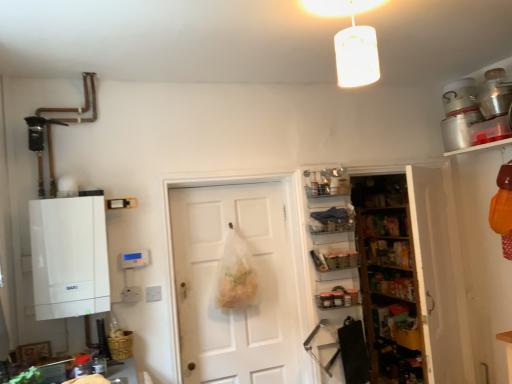
Image resolution: width=512 pixels, height=384 pixels. Describe the element at coordinates (69, 257) in the screenshot. I see `white matte boiler at left` at that location.

What is the approximate height of clear plastic shelves at center, the 4th shelf from the bottom?

It is 9.45 inches.

Measure the distance between point [507,110] and camera.

They are 2.73 meters apart.

At what (x,y) coordinates should I click in order to perform the action: click on white matte boiler at left. Please return your answer as a coordinate pair (x, y). Looking at the image, I should click on tap(69, 257).

From a real-world perspective, is metallic silver pot at upper right, the 1th appliance viewed from the front, on metallic silver spice jars at center-right, placed as the fourth shelf when sorted from top to bottom?

Correct, in the physical world, metallic silver pot at upper right, the 1th appliance viewed from the front, is higher than metallic silver spice jars at center-right, placed as the fourth shelf when sorted from top to bottom.

How many degrees apart are the facing directions of metallic silver pot at upper right, the 1th appliance viewed from the front, and metallic silver spice jars at center-right, placed as the fourth shelf when sorted from top to bottom?

91.3 degrees.

From the image's perspective, is metallic silver pot at upper right, the 1th appliance viewed from the front, located above or below metallic silver spice jars at center-right, placed as the fourth shelf when sorted from top to bottom?

metallic silver pot at upper right, the 1th appliance viewed from the front, is above metallic silver spice jars at center-right, placed as the fourth shelf when sorted from top to bottom.

From the image's perspective, does wooden shelves at right, marked as the third shelf in a top-to-bottom arrangement, appear lower than white matte cylinder at upper center?

Correct, wooden shelves at right, marked as the third shelf in a top-to-bottom arrangement, appears lower than white matte cylinder at upper center in the image.

Considering the relative sizes of wooden shelves at right, which appears as the second shelf when ordered from the bottom, and white matte cylinder at upper center in the image provided, is wooden shelves at right, which appears as the second shelf when ordered from the bottom, shorter than white matte cylinder at upper center?

Incorrect, the height of wooden shelves at right, which appears as the second shelf when ordered from the bottom, does not fall short of that of white matte cylinder at upper center.

Which point is more distant from viewer, (414,262) or (320,10)?

Point (414,262)

Considering their positions, is wooden shelves at right, marked as the third shelf in a top-to-bottom arrangement, located in front of or behind white matte cylinder at upper center?

In the image, wooden shelves at right, marked as the third shelf in a top-to-bottom arrangement, appears behind white matte cylinder at upper center.

Looking at their sizes, would you say bamboo basket at lower left is wider or thinner than clear plastic shelves at center, the first shelf when ordered from top to bottom?

Answer: In the image, bamboo basket at lower left appears to be wider than clear plastic shelves at center, the first shelf when ordered from top to bottom.

Can we say bamboo basket at lower left lies outside clear plastic shelves at center, the first shelf when ordered from top to bottom?

Yes, bamboo basket at lower left is not within clear plastic shelves at center, the first shelf when ordered from top to bottom.

Between bamboo basket at lower left and clear plastic shelves at center, the first shelf when ordered from top to bottom, which one appears on the left side from the viewer's perspective?

bamboo basket at lower left.

From the image's perspective, is metallic silver spice jars at center-right, placed as the fourth shelf when sorted from top to bottom, below white matte door at center?

Yes.

Can you confirm if metallic silver spice jars at center-right, placed as the fourth shelf when sorted from top to bottom, is smaller than white matte door at center?

Correct, metallic silver spice jars at center-right, placed as the fourth shelf when sorted from top to bottom, occupies less space than white matte door at center.

Does point (342, 299) appear closer or farther from the camera than point (225, 367)?

Point (342, 299) is positioned closer to the camera compared to point (225, 367).

Is metallic silver spice jars at center-right, placed as the fourth shelf when sorted from top to bottom, next to clear plastic shelves at center, the 4th shelf from the bottom, and touching it?

No, metallic silver spice jars at center-right, placed as the fourth shelf when sorted from top to bottom, is not making contact with clear plastic shelves at center, the 4th shelf from the bottom.

Could you tell me if metallic silver spice jars at center-right, the 1th shelf in the bottom-to-top sequence, is facing clear plastic shelves at center, the 4th shelf from the bottom?

No, metallic silver spice jars at center-right, the 1th shelf in the bottom-to-top sequence, is not facing towards clear plastic shelves at center, the 4th shelf from the bottom.

Is metallic silver spice jars at center-right, placed as the fourth shelf when sorted from top to bottom, completely or partially outside of clear plastic shelves at center, the first shelf when ordered from top to bottom?

That's correct, metallic silver spice jars at center-right, placed as the fourth shelf when sorted from top to bottom, is outside of clear plastic shelves at center, the first shelf when ordered from top to bottom.

Is the position of metallic silver spice jars at center-right, the 1th shelf in the bottom-to-top sequence, more distant than that of clear plastic shelves at center, the first shelf when ordered from top to bottom?

No, metallic silver spice jars at center-right, the 1th shelf in the bottom-to-top sequence, is closer to the viewer.

Is clear plastic shelves at center, the first shelf when ordered from top to bottom, thinner than white matte cylinder at upper center?

Correct, the width of clear plastic shelves at center, the first shelf when ordered from top to bottom, is less than that of white matte cylinder at upper center.

Based on the photo, from the image's perspective, is clear plastic shelves at center, the first shelf when ordered from top to bottom, positioned above or below white matte cylinder at upper center?

From the image's perspective, clear plastic shelves at center, the first shelf when ordered from top to bottom, appears below white matte cylinder at upper center.

Would you consider clear plastic shelves at center, the first shelf when ordered from top to bottom, to be distant from white matte cylinder at upper center?

That's right, there is a large distance between clear plastic shelves at center, the first shelf when ordered from top to bottom, and white matte cylinder at upper center.

From a real-world perspective, which object stands above the other?

From a 3D spatial view, metallic silver pot at upper right, the 1th appliance viewed from the front, is above.

Between metallic silver pot at upper right, acting as the 2th appliance starting from the back, and metallic silver spice rack at center-right, arranged as the third shelf when ordered from the bottom, which one is positioned in front?

metallic silver pot at upper right, acting as the 2th appliance starting from the back, is in front.

Is metallic silver pot at upper right, acting as the 2th appliance starting from the back, oriented towards metallic silver spice rack at center-right, which ranks as the 2th shelf in top-to-bottom order?

No, metallic silver pot at upper right, acting as the 2th appliance starting from the back, is not aimed at metallic silver spice rack at center-right, which ranks as the 2th shelf in top-to-bottom order.

Which of these two, metallic silver pot at upper right, the 1th appliance viewed from the front, or metallic silver spice rack at center-right, which ranks as the 2th shelf in top-to-bottom order, is smaller?

metallic silver spice rack at center-right, which ranks as the 2th shelf in top-to-bottom order, is smaller.

Where is `the 1st appliance directly above the metallic silver spice jars at center-right, placed as the fourth shelf when sorted from top to bottom (from a real-world perspective)`? The image size is (512, 384). the 1st appliance directly above the metallic silver spice jars at center-right, placed as the fourth shelf when sorted from top to bottom (from a real-world perspective) is located at coordinates (495, 94).

You are a GUI agent. You are given a task and a screenshot of the screen. Output one action in this format:
    pyautogui.click(x=<x>, y=<y>)
    Task: Click on the 4th shelf behind the white matte cylinder at upper center, counting from the anchor's position
    Image resolution: width=512 pixels, height=384 pixels.
    Given the screenshot: What is the action you would take?
    pyautogui.click(x=391, y=278)

Based on their spatial positions, is silver metallic canister at upper right, the 2th appliance from the front, or metallic silver spice rack at center-right, arranged as the third shelf when ordered from the bottom, further from white matte boiler at left?

The object further to white matte boiler at left is silver metallic canister at upper right, the 2th appliance from the front.

Which object lies nearer to the anchor point white matte boiler at left, silver metallic canister at upper right, marked as the first appliance in a back-to-front arrangement, or white matte door at center?

The object closer to white matte boiler at left is white matte door at center.

From the image, which object appears to be nearer to metallic silver spice jars at center-right, placed as the fourth shelf when sorted from top to bottom, metallic silver pot at upper right, acting as the 2th appliance starting from the back, or white matte cylinder at upper center?

metallic silver pot at upper right, acting as the 2th appliance starting from the back, lies closer to metallic silver spice jars at center-right, placed as the fourth shelf when sorted from top to bottom, than the other object.

When comparing their distances from bamboo basket at lower left, does metallic silver pot at upper right, the 1th appliance viewed from the front, or wooden shelves at right, marked as the third shelf in a top-to-bottom arrangement, seem further?

The object further to bamboo basket at lower left is metallic silver pot at upper right, the 1th appliance viewed from the front.

Based on their spatial positions, is silver metallic canister at upper right, the 2th appliance from the front, or metallic silver spice rack at center-right, arranged as the third shelf when ordered from the bottom, further from metallic silver pot at upper right, the 1th appliance viewed from the front?

metallic silver spice rack at center-right, arranged as the third shelf when ordered from the bottom, lies further to metallic silver pot at upper right, the 1th appliance viewed from the front, than the other object.

Which object lies further to the anchor point white matte boiler at left, metallic silver spice rack at center-right, which ranks as the 2th shelf in top-to-bottom order, or metallic silver spice jars at center-right, placed as the fourth shelf when sorted from top to bottom?

metallic silver spice jars at center-right, placed as the fourth shelf when sorted from top to bottom.

Considering their positions, is white matte cylinder at upper center positioned further to bamboo basket at lower left than metallic silver spice rack at center-right, arranged as the third shelf when ordered from the bottom?

white matte cylinder at upper center.

When comparing their distances from metallic silver spice rack at center-right, which ranks as the 2th shelf in top-to-bottom order, does bamboo basket at lower left or metallic silver spice jars at center-right, placed as the fourth shelf when sorted from top to bottom, seem further?

bamboo basket at lower left lies further to metallic silver spice rack at center-right, which ranks as the 2th shelf in top-to-bottom order, than the other object.

I want to click on basket between white matte boiler at left and white matte door at center from left to right, so click(x=121, y=345).

Locate an element on the screen. light fixture situated between white matte boiler at left and clear plastic shelves at center, the first shelf when ordered from top to bottom, from left to right is located at coordinates (351, 41).

The height and width of the screenshot is (384, 512). In order to click on light fixture between bamboo basket at lower left and wooden shelves at right, which appears as the second shelf when ordered from the bottom, in the horizontal direction in this screenshot , I will do `click(351, 41)`.

Identify the location of basket situated between white matte boiler at left and wooden shelves at right, marked as the third shelf in a top-to-bottom arrangement, from left to right. The height and width of the screenshot is (384, 512). (121, 345).